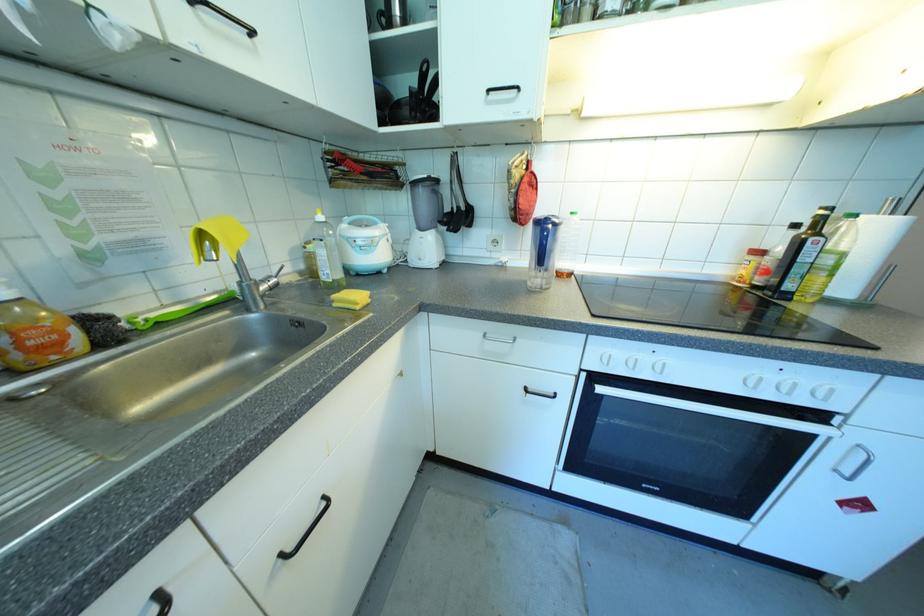
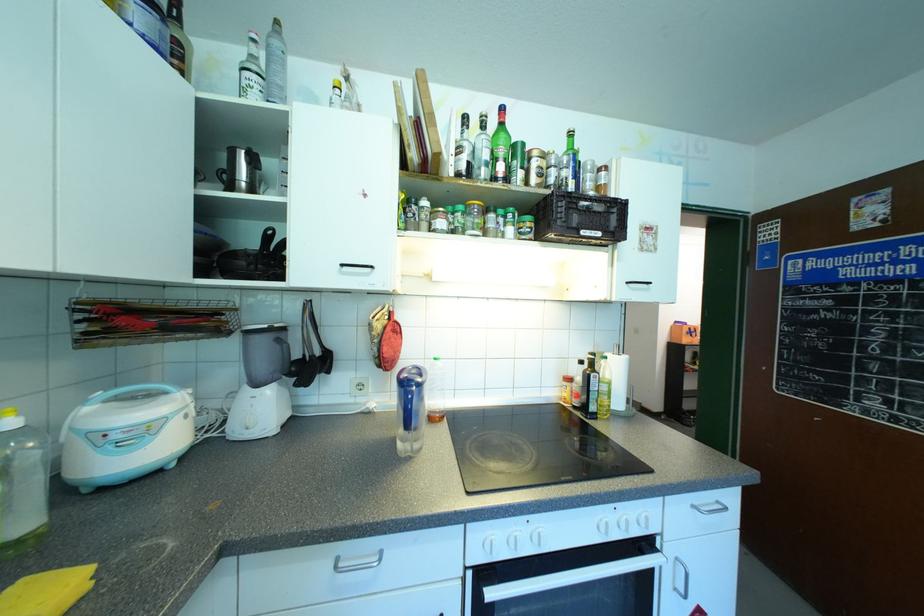
Where in the second image is the point corresponding to [514,339] from the first image?

(380, 557)